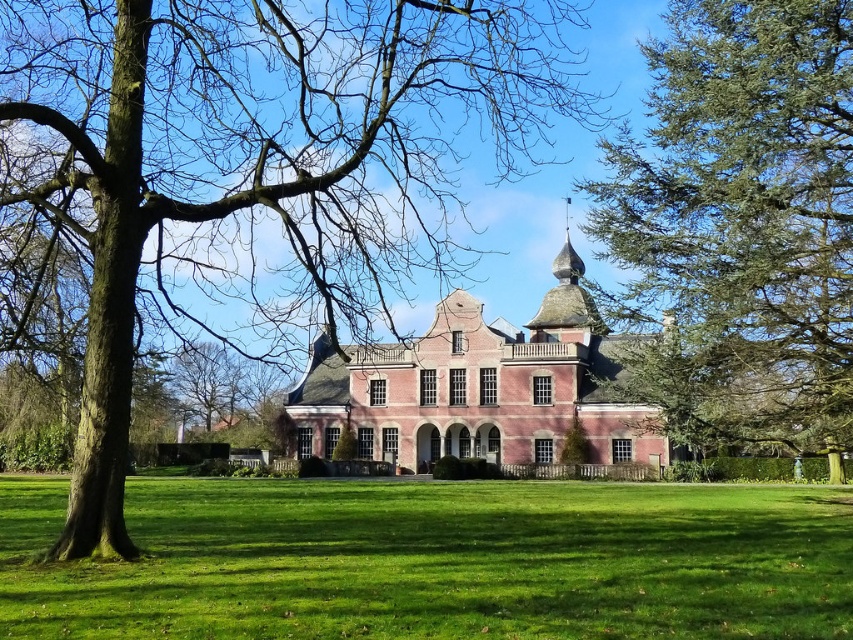
Describe the element at coordinates (250, 166) in the screenshot. I see `brown bark tree at center` at that location.

Who is more distant from viewer, (151, 224) or (372, 432)?

The point (372, 432) is behind.

The image size is (853, 640). Find the location of `brown bark tree at center`. brown bark tree at center is located at coordinates (250, 166).

How far apart are brown bark tree at center and green needle-like tree at upper right?

The distance of brown bark tree at center from green needle-like tree at upper right is 30.32 meters.

Who is positioned more to the left, brown bark tree at center or green needle-like tree at upper right?

brown bark tree at center is more to the left.

Where is `brown bark tree at center`? brown bark tree at center is located at coordinates (250, 166).

From the picture: Which is more to the right, green needle-like tree at upper right or brick mansion at center?

green needle-like tree at upper right

Is point (643, 275) farther from viewer compared to point (405, 468)?

No, (643, 275) is closer to viewer.

Is point (756, 157) positioned in front of point (457, 451)?

That is True.

This screenshot has height=640, width=853. I want to click on green needle-like tree at upper right, so click(x=741, y=224).